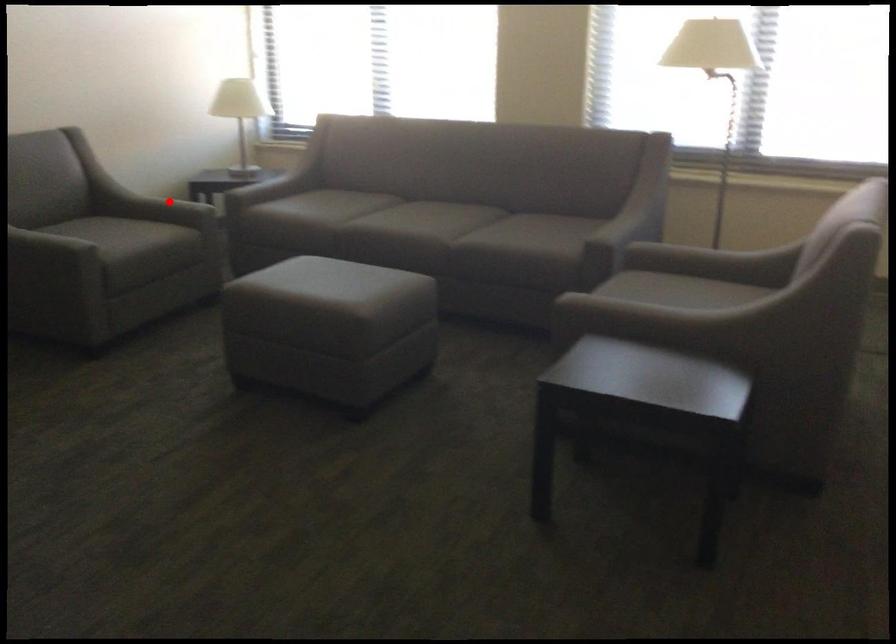
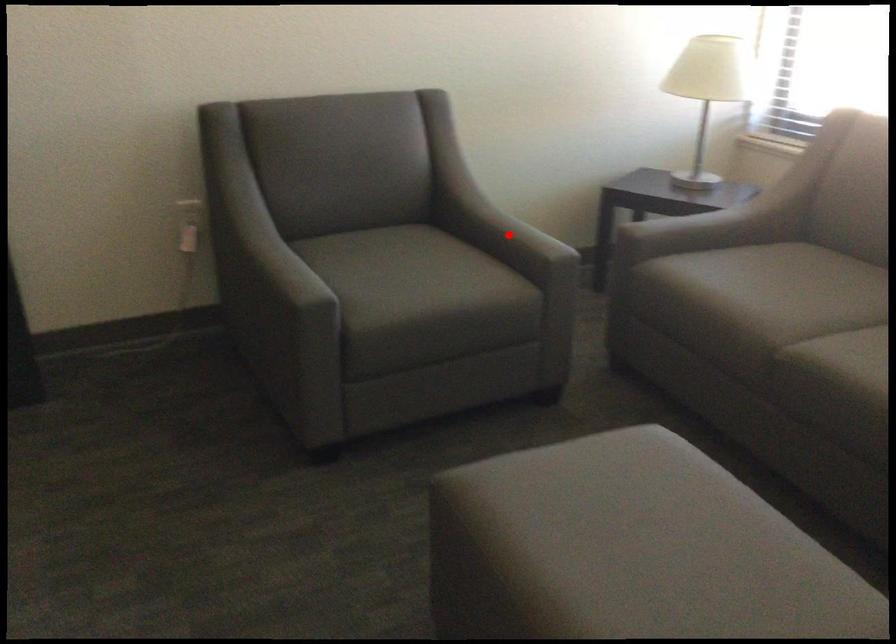
I am providing you with two images of the same scene from different viewpoints. A red point is marked on the first image and another point is marked on the second image. Do the highlighted points in image1 and image2 indicate the same real-world spot?

Yes